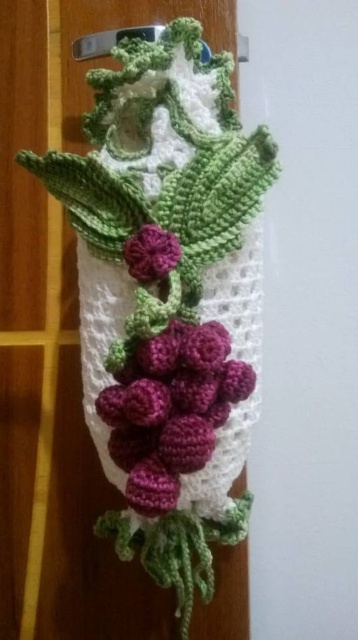
Does point (210, 556) lie in front of point (151, 458)?

No.

Which is more to the left, crochet scarf at center or matte purple yarn grapes at center?

Positioned to the left is crochet scarf at center.

Where is `crochet scarf at center`? crochet scarf at center is located at coordinates (167, 300).

Between crochet scarf at center and matte purple flower at center, which one appears on the left side from the viewer's perspective?

matte purple flower at center

How distant is crochet scarf at center from matte purple flower at center?

7.67 inches

At what (x,y) coordinates should I click in order to perform the action: click on crochet scarf at center. Please return your answer as a coordinate pair (x, y). This screenshot has height=640, width=358. Looking at the image, I should click on click(x=167, y=300).

From the picture: Who is more forward, (119, 461) or (131, 253)?

Point (119, 461)

Can you confirm if matte purple yarn grapes at center is wider than matte purple flower at center?

Indeed, matte purple yarn grapes at center has a greater width compared to matte purple flower at center.

Locate an element on the screen. This screenshot has height=640, width=358. matte purple yarn grapes at center is located at coordinates (171, 408).

This screenshot has width=358, height=640. I want to click on matte purple yarn grapes at center, so click(x=171, y=408).